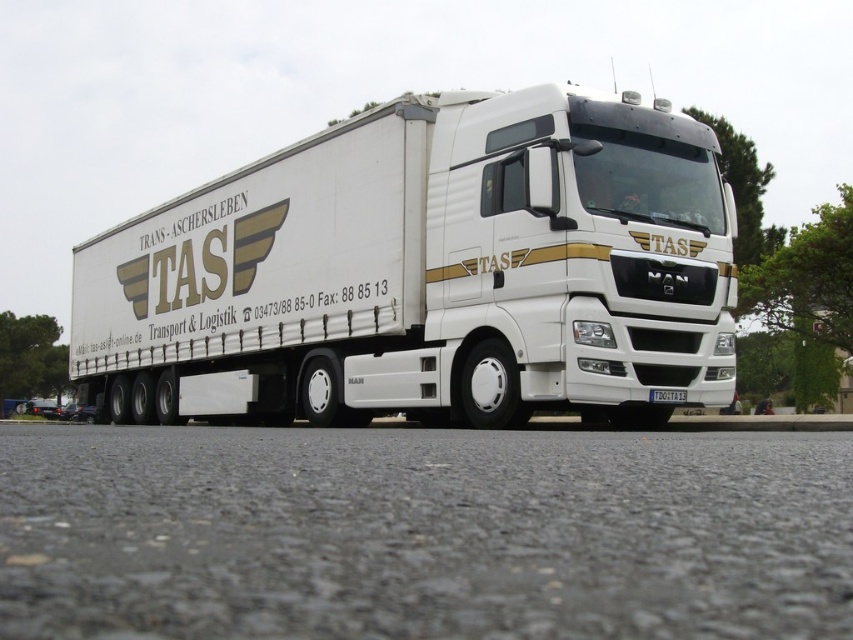
Does white glossy truck at center have a lesser width compared to white plastic license plate at center?

No.

Locate an element on the screen. This screenshot has height=640, width=853. white glossy truck at center is located at coordinates pyautogui.click(x=426, y=273).

Identify the location of white glossy truck at center. The height and width of the screenshot is (640, 853). (426, 273).